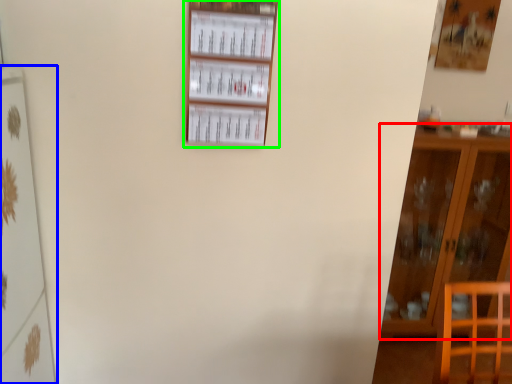
Question: Based on their relative distances, which object is farther from furniture (highlighted by a red box)? Choose from shelf (highlighted by a blue box) and shelf (highlighted by a green box).

Choices:
 (A) shelf
 (B) shelf

Answer: (A)